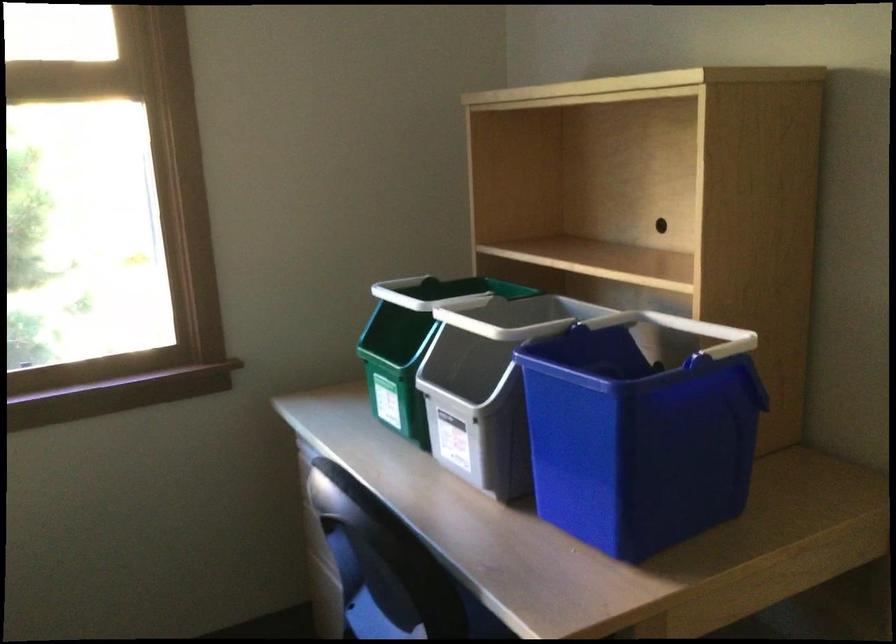
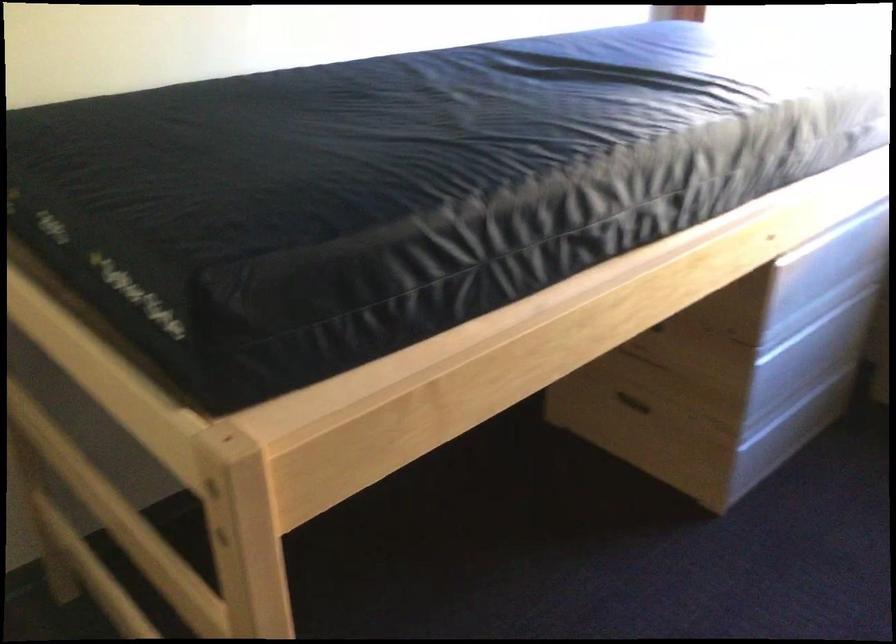
How did the camera likely rotate?

The camera's rotation is toward left-down.